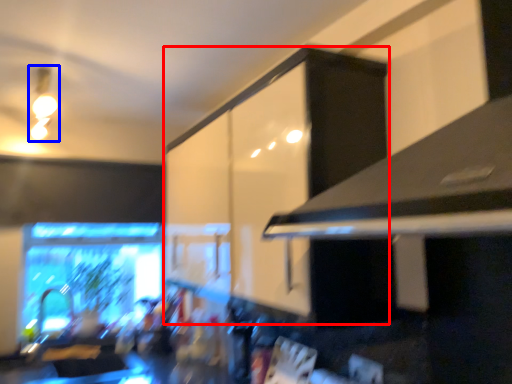
Question: Which object is closer to the camera taking this photo, cabinetry (highlighted by a red box) or light fixture (highlighted by a blue box)?

Choices:
 (A) cabinetry
 (B) light fixture

Answer: (A)